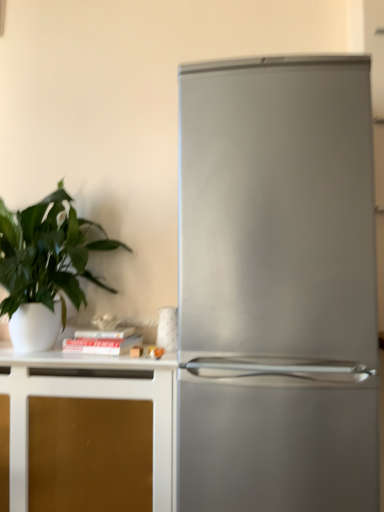
Locate an element on the screen. Image resolution: width=384 pixels, height=512 pixels. stainless steel refrigerator at right is located at coordinates (277, 286).

Identify the location of stainless steel refrigerator at right. The height and width of the screenshot is (512, 384). (277, 286).

Considering the relative sizes of green matte plant at left and stainless steel refrigerator at right in the image provided, is green matte plant at left taller than stainless steel refrigerator at right?

Incorrect, the height of green matte plant at left is not larger of that of stainless steel refrigerator at right.

Considering the points (83, 267) and (236, 156), which point is behind, point (83, 267) or point (236, 156)?

Positioned behind is point (83, 267).

Can you tell me how much green matte plant at left and stainless steel refrigerator at right differ in facing direction?

There is a 1.36e-05-degree angle between the facing directions of green matte plant at left and stainless steel refrigerator at right.

Does green matte plant at left appear on the left side of stainless steel refrigerator at right?

Yes, green matte plant at left is to the left of stainless steel refrigerator at right.

From a real-world perspective, which is physically above, gold matte cabinet at lower left or stainless steel refrigerator at right?

stainless steel refrigerator at right is physically above.

Does gold matte cabinet at lower left have a larger size compared to stainless steel refrigerator at right?

Actually, gold matte cabinet at lower left might be smaller than stainless steel refrigerator at right.

Is point (158, 433) positioned before point (218, 199)?

No.

From the image's perspective, between gold matte cabinet at lower left and stainless steel refrigerator at right, which one is located above?

stainless steel refrigerator at right appears higher in the image.

Can you confirm if stainless steel refrigerator at right is thinner than green matte plant at left?

In fact, stainless steel refrigerator at right might be wider than green matte plant at left.

Considering the sizes of objects stainless steel refrigerator at right and green matte plant at left in the image provided, who is taller, stainless steel refrigerator at right or green matte plant at left?

Standing taller between the two is stainless steel refrigerator at right.

Which point is more forward, (282,328) or (62,284)?

The point (282,328) is closer to the camera.

Are green matte plant at left and gold matte cabinet at lower left beside each other?

green matte plant at left and gold matte cabinet at lower left are clearly separated.

Can you tell me how much green matte plant at left and gold matte cabinet at lower left differ in facing direction?

1.33e-05 degrees.

Is green matte plant at left turned away from gold matte cabinet at lower left?

No.

From the image's perspective, would you say stainless steel refrigerator at right is shown under gold matte cabinet at lower left?

Incorrect, from the image's perspective, stainless steel refrigerator at right is higher than gold matte cabinet at lower left.

Is stainless steel refrigerator at right facing away from gold matte cabinet at lower left?

No, stainless steel refrigerator at right is not facing away from gold matte cabinet at lower left.

Is stainless steel refrigerator at right located outside gold matte cabinet at lower left?

That's correct, stainless steel refrigerator at right is outside of gold matte cabinet at lower left.

How much distance is there between gold matte cabinet at lower left and green matte plant at left?

gold matte cabinet at lower left and green matte plant at left are 13.38 inches apart.

How different are the orientations of gold matte cabinet at lower left and green matte plant at left in degrees?

The facing directions of gold matte cabinet at lower left and green matte plant at left are 1.33e-05 degrees apart.

Can you confirm if gold matte cabinet at lower left is positioned to the right of green matte plant at left?

Yes.

Is gold matte cabinet at lower left completely or partially outside of green matte plant at left?

Yes, gold matte cabinet at lower left is outside of green matte plant at left.

The height and width of the screenshot is (512, 384). I want to click on refrigerator located in front of the green matte plant at left, so click(x=277, y=286).

Find the location of a particular element. refrigerator that is above the gold matte cabinet at lower left (from the image's perspective) is located at coordinates (277, 286).

Which object lies nearer to the anchor point green matte plant at left, stainless steel refrigerator at right or gold matte cabinet at lower left?

gold matte cabinet at lower left is closer to green matte plant at left.

Considering their positions, is green matte plant at left positioned further to gold matte cabinet at lower left than stainless steel refrigerator at right?

Based on the image, stainless steel refrigerator at right appears to be further to gold matte cabinet at lower left.

Considering their positions, is stainless steel refrigerator at right positioned closer to gold matte cabinet at lower left than green matte plant at left?

green matte plant at left is positioned closer to the anchor gold matte cabinet at lower left.

In the scene shown: Considering their positions, is gold matte cabinet at lower left positioned closer to green matte plant at left than stainless steel refrigerator at right?

gold matte cabinet at lower left.

Looking at the image, which one is located closer to stainless steel refrigerator at right, green matte plant at left or gold matte cabinet at lower left?

gold matte cabinet at lower left lies closer to stainless steel refrigerator at right than the other object.

Estimate the real-world distances between objects in this image. Which object is closer to stainless steel refrigerator at right, gold matte cabinet at lower left or green matte plant at left?

gold matte cabinet at lower left is closer to stainless steel refrigerator at right.

Locate an element on the screen. The width and height of the screenshot is (384, 512). cabinetry between green matte plant at left and stainless steel refrigerator at right is located at coordinates (91, 398).